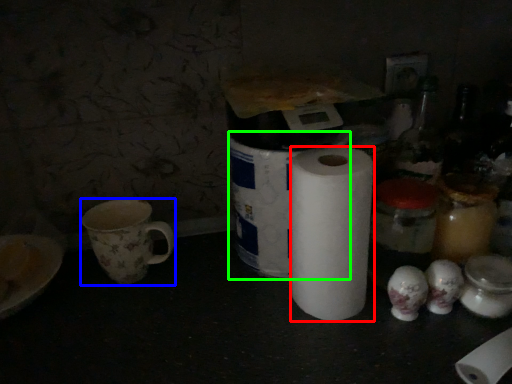
Question: Which object is the farthest from paper towel (highlighted by a red box)? Choose among these: coffee cup (highlighted by a blue box) or toilet paper (highlighted by a green box).

Choices:
 (A) coffee cup
 (B) toilet paper

Answer: (A)